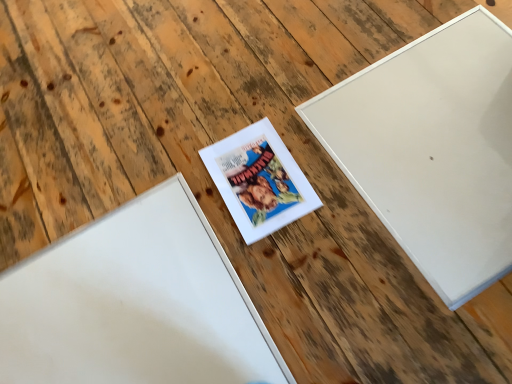
The width and height of the screenshot is (512, 384). Find the location of `vacant space behind white matte picture frame at center, which is the second picture frame from left to right`. vacant space behind white matte picture frame at center, which is the second picture frame from left to right is located at coordinates (234, 105).